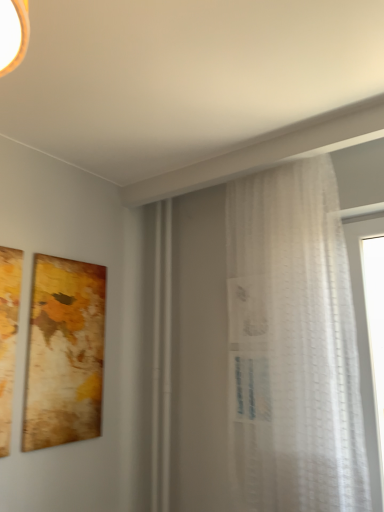
Question: From a real-world perspective, is matte gold picture frame at left positioned over white sheer curtain at right based on gravity?

Choices:
 (A) no
 (B) yes

Answer: (A)

Question: Can you confirm if matte gold picture frame at left is thinner than white sheer curtain at right?

Choices:
 (A) no
 (B) yes

Answer: (B)

Question: Is matte gold picture frame at left outside of white sheer curtain at right?

Choices:
 (A) yes
 (B) no

Answer: (A)

Question: Is matte gold picture frame at left placed right next to white sheer curtain at right?

Choices:
 (A) yes
 (B) no

Answer: (B)

Question: Is matte gold picture frame at left looking in the opposite direction of white sheer curtain at right?

Choices:
 (A) yes
 (B) no

Answer: (B)

Question: Considering the relative sizes of matte gold picture frame at left and white sheer curtain at right in the image provided, is matte gold picture frame at left smaller than white sheer curtain at right?

Choices:
 (A) no
 (B) yes

Answer: (B)

Question: Does white sheer curtain at right have a smaller size compared to matte gold picture frame at left?

Choices:
 (A) no
 (B) yes

Answer: (A)

Question: From a real-world perspective, does white sheer curtain at right stand above matte gold picture frame at left?

Choices:
 (A) yes
 (B) no

Answer: (A)

Question: Is white sheer curtain at right facing towards matte gold picture frame at left?

Choices:
 (A) no
 (B) yes

Answer: (A)

Question: Considering the relative positions of white sheer curtain at right and matte gold picture frame at left in the image provided, is white sheer curtain at right behind matte gold picture frame at left?

Choices:
 (A) yes
 (B) no

Answer: (B)

Question: Can you confirm if white sheer curtain at right is positioned to the left of matte gold picture frame at left?

Choices:
 (A) yes
 (B) no

Answer: (B)

Question: Can you confirm if white sheer curtain at right is wider than matte gold picture frame at left?

Choices:
 (A) yes
 (B) no

Answer: (A)

Question: Visually, is white sheer curtain at right positioned to the left or to the right of matte gold picture frame at left?

Choices:
 (A) left
 (B) right

Answer: (B)